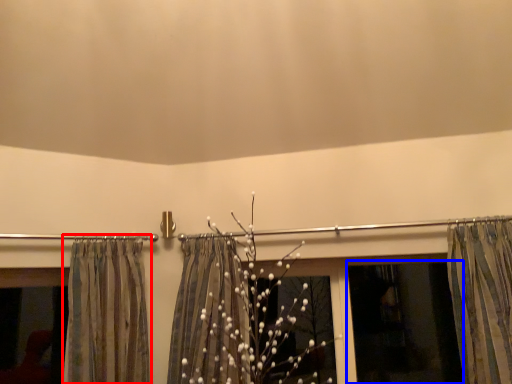
Question: Which point is closer to the camera, curtain (highlighted by a red box) or window screen (highlighted by a blue box)?

Choices:
 (A) curtain
 (B) window screen

Answer: (A)